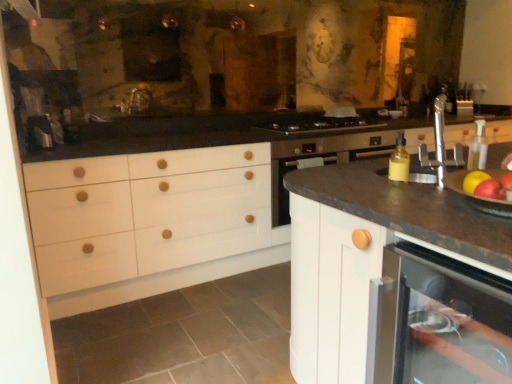
Question: Is shiny red apple at right, which ranks as the second apple in front-to-back order, oriented away from red matte apple at right, the second apple from the back?

Choices:
 (A) yes
 (B) no

Answer: (B)

Question: Considering the relative sizes of shiny red apple at right, which ranks as the second apple in front-to-back order, and red matte apple at right, which is the 1th apple from front to back, in the image provided, is shiny red apple at right, which ranks as the second apple in front-to-back order, smaller than red matte apple at right, which is the 1th apple from front to back,?

Choices:
 (A) no
 (B) yes

Answer: (A)

Question: Is shiny red apple at right, which ranks as the second apple in front-to-back order, at the left side of red matte apple at right, which is the 1th apple from front to back?

Choices:
 (A) no
 (B) yes

Answer: (A)

Question: From a real-world perspective, is shiny red apple at right, which ranks as the second apple in front-to-back order, positioned over red matte apple at right, the second apple from the back, based on gravity?

Choices:
 (A) yes
 (B) no

Answer: (B)

Question: Considering the relative sizes of shiny red apple at right, which ranks as the second apple in front-to-back order, and red matte apple at right, which is the 1th apple from front to back, in the image provided, is shiny red apple at right, which ranks as the second apple in front-to-back order, thinner than red matte apple at right, which is the 1th apple from front to back,?

Choices:
 (A) yes
 (B) no

Answer: (B)

Question: Is shiny red apple at right, which ranks as the second apple in front-to-back order, to the right of red matte apple at right, the second apple from the back, from the viewer's perspective?

Choices:
 (A) yes
 (B) no

Answer: (A)

Question: Considering the relative positions of shiny red apple at right, arranged as the 1th apple when viewed from the back, and stainless steel gas stove at center in the image provided, is shiny red apple at right, arranged as the 1th apple when viewed from the back, to the right of stainless steel gas stove at center from the viewer's perspective?

Choices:
 (A) yes
 (B) no

Answer: (A)

Question: Is shiny red apple at right, arranged as the 1th apple when viewed from the back, closer to the viewer compared to stainless steel gas stove at center?

Choices:
 (A) yes
 (B) no

Answer: (A)

Question: Does shiny red apple at right, arranged as the 1th apple when viewed from the back, have a smaller size compared to stainless steel gas stove at center?

Choices:
 (A) no
 (B) yes

Answer: (B)

Question: Is shiny red apple at right, arranged as the 1th apple when viewed from the back, wider than stainless steel gas stove at center?

Choices:
 (A) no
 (B) yes

Answer: (A)

Question: Is shiny red apple at right, arranged as the 1th apple when viewed from the back, facing away from stainless steel gas stove at center?

Choices:
 (A) no
 (B) yes

Answer: (A)

Question: From the image's perspective, is shiny red apple at right, which ranks as the second apple in front-to-back order, beneath stainless steel gas stove at center?

Choices:
 (A) yes
 (B) no

Answer: (A)

Question: Is matte white dishwasher at lower right not within white matte cabinet at center?

Choices:
 (A) no
 (B) yes

Answer: (A)